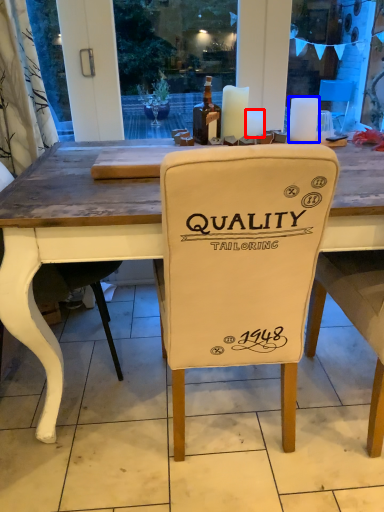
Question: Which object is further to the camera taking this photo, candle (highlighted by a red box) or candle (highlighted by a blue box)?

Choices:
 (A) candle
 (B) candle

Answer: (A)